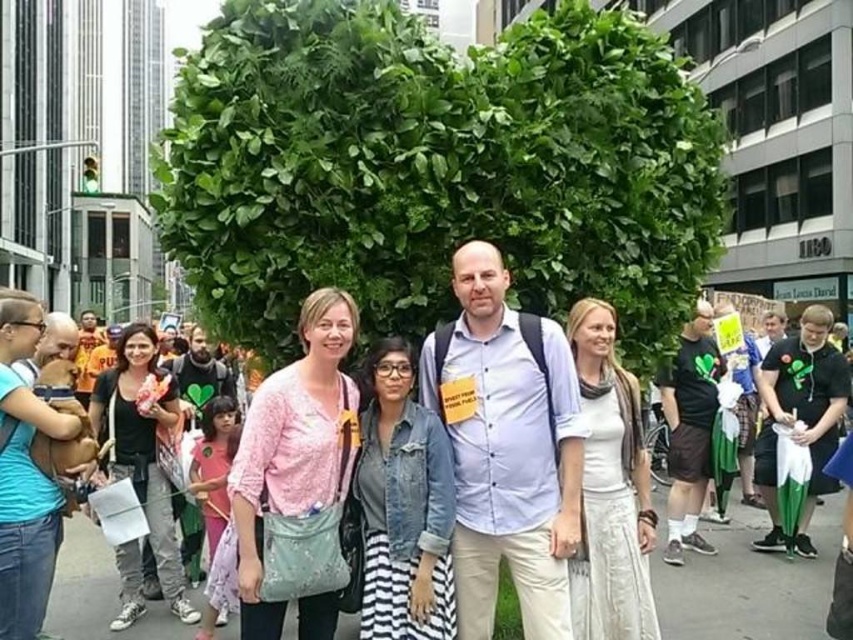
Who is lower down, light blue button-down shirt at center or pink fabric shirt at center?

pink fabric shirt at center

In the scene shown: Is the position of light blue button-down shirt at center less distant than that of pink fabric shirt at center?

Yes, light blue button-down shirt at center is in front of pink fabric shirt at center.

At what (x,y) coordinates should I click in order to perform the action: click on light blue button-down shirt at center. Please return your answer as a coordinate pair (x, y). Looking at the image, I should click on (508, 451).

Does green leafy tree at center have a greater height compared to gray asphalt at lower center?

Yes.

Can you confirm if green leafy tree at center is wider than gray asphalt at lower center?

Yes.

This screenshot has height=640, width=853. What do you see at coordinates (434, 168) in the screenshot? I see `green leafy tree at center` at bounding box center [434, 168].

This screenshot has width=853, height=640. In order to click on green leafy tree at center in this screenshot , I will do `click(434, 168)`.

Looking at this image, who is taller, green leafy tree at center or light blue button-down shirt at center?

Standing taller between the two is green leafy tree at center.

In the scene shown: Between green leafy tree at center and light blue button-down shirt at center, which one has less height?

light blue button-down shirt at center is shorter.

Where is `green leafy tree at center`? This screenshot has width=853, height=640. green leafy tree at center is located at coordinates (x=434, y=168).